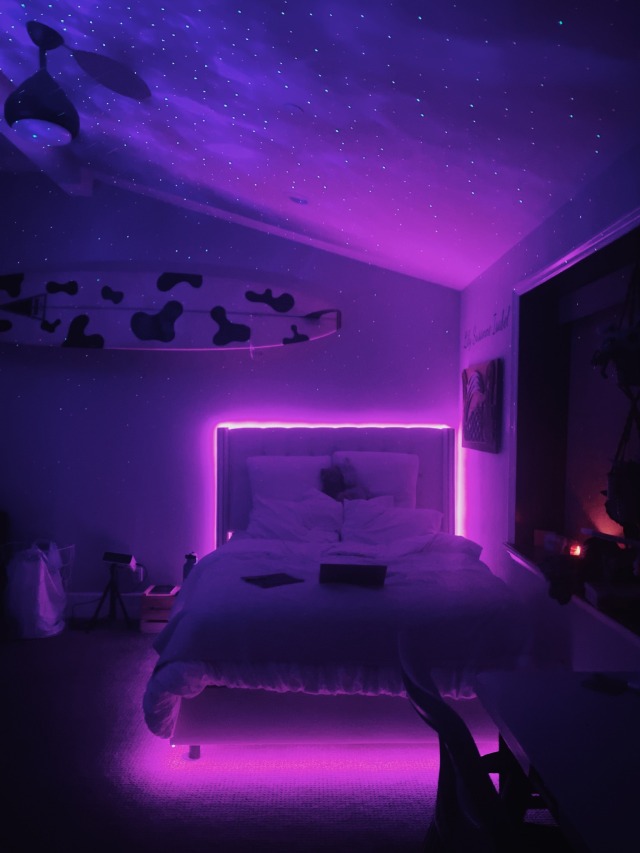
Image resolution: width=640 pixels, height=853 pixels. Find the location of `pillow`. pillow is located at coordinates (291, 463), (388, 471).